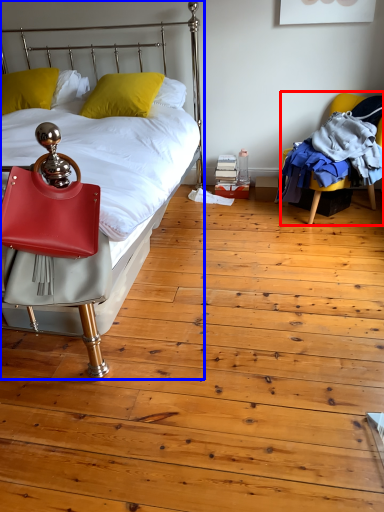
Question: Which object appears farthest to the camera in this image, chair (highlighted by a red box) or bed (highlighted by a blue box)?

Choices:
 (A) chair
 (B) bed

Answer: (A)